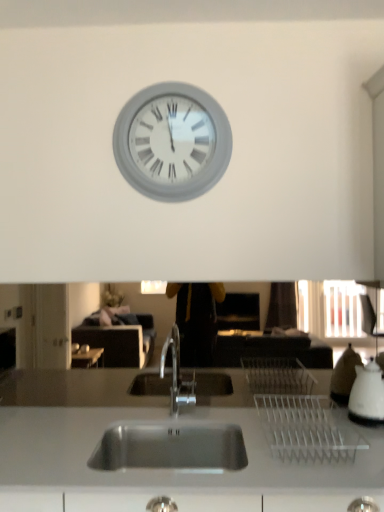
Locate an element on the screen. The width and height of the screenshot is (384, 512). empty space that is ontop of white matte clock at upper center is located at coordinates (x=170, y=79).